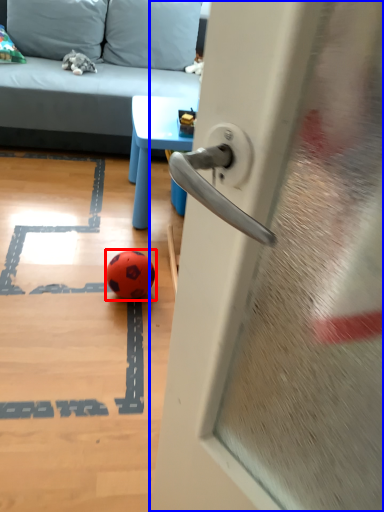
Question: Which of the following is the farthest to the observer, ball (highlighted by a red box) or door (highlighted by a blue box)?

Choices:
 (A) ball
 (B) door

Answer: (A)